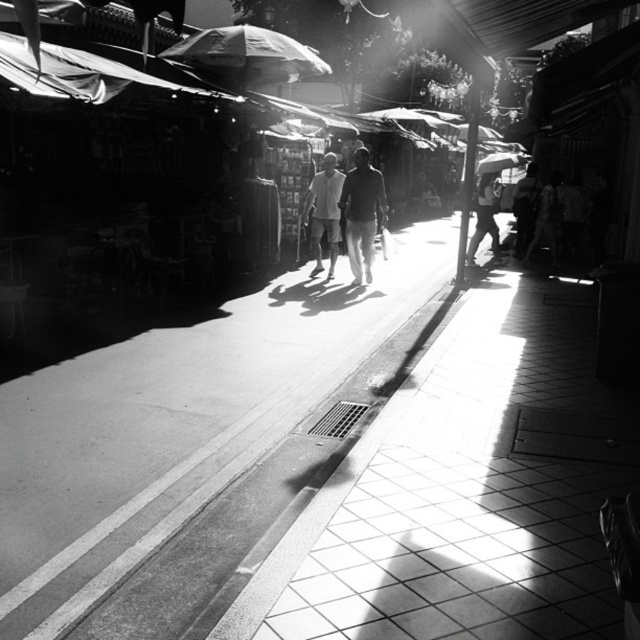
Does light beige pants at center have a greater height compared to white fabric umbrella at upper center?

Incorrect, light beige pants at center's height is not larger of white fabric umbrella at upper center's.

Between point (332, 202) and point (483, 161), which one is positioned behind?

Point (483, 161)

Describe the element at coordinates (324, 211) in the screenshot. I see `light beige pants at center` at that location.

Identify the location of light beige pants at center. (324, 211).

Can you confirm if translucent fabric umbrella at upper center is bigger than dark textured pants at center?

Incorrect, translucent fabric umbrella at upper center is not larger than dark textured pants at center.

Does translucent fabric umbrella at upper center appear under dark textured pants at center?

No.

Which is in front, point (234, 26) or point (356, 173)?

Point (356, 173)

This screenshot has height=640, width=640. What are the coordinates of `translucent fabric umbrella at upper center` in the screenshot? It's located at (248, 54).

Is smooth concrete pavement at center closer to the viewer compared to dark textured pants at center?

Yes, smooth concrete pavement at center is in front of dark textured pants at center.

Is smooth concrete pavement at center bigger than dark textured pants at center?

Correct, smooth concrete pavement at center is larger in size than dark textured pants at center.

Which is in front, point (412, 305) or point (365, 280)?

Point (412, 305) is in front.

Find the location of a particular element. This screenshot has height=640, width=640. smooth concrete pavement at center is located at coordinates (195, 412).